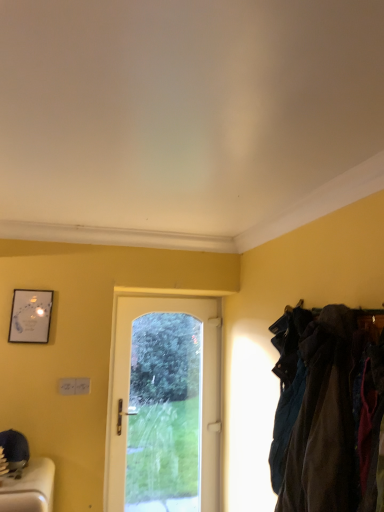
Question: Would you say dark blue fabric at right contains matte silver picture frame at upper left?

Choices:
 (A) yes
 (B) no

Answer: (B)

Question: Would you say dark blue fabric at right is a long distance from matte silver picture frame at upper left?

Choices:
 (A) yes
 (B) no

Answer: (A)

Question: Considering the relative sizes of dark blue fabric at right and matte silver picture frame at upper left in the image provided, is dark blue fabric at right thinner than matte silver picture frame at upper left?

Choices:
 (A) no
 (B) yes

Answer: (A)

Question: Considering the relative positions of dark blue fabric at right and matte silver picture frame at upper left in the image provided, is dark blue fabric at right to the left of matte silver picture frame at upper left from the viewer's perspective?

Choices:
 (A) no
 (B) yes

Answer: (A)

Question: From a real-world perspective, is dark blue fabric at right below matte silver picture frame at upper left?

Choices:
 (A) no
 (B) yes

Answer: (B)

Question: Is dark blue fabric at right not within matte silver picture frame at upper left?

Choices:
 (A) yes
 (B) no

Answer: (A)

Question: Is matte silver picture frame at upper left positioned beyond the bounds of dark blue fabric at right?

Choices:
 (A) no
 (B) yes

Answer: (B)

Question: Is matte silver picture frame at upper left bigger than dark blue fabric at right?

Choices:
 (A) no
 (B) yes

Answer: (A)

Question: From a real-world perspective, is matte silver picture frame at upper left over dark blue fabric at right?

Choices:
 (A) yes
 (B) no

Answer: (A)

Question: Can you confirm if matte silver picture frame at upper left is taller than dark blue fabric at right?

Choices:
 (A) no
 (B) yes

Answer: (A)

Question: Considering the relative sizes of matte silver picture frame at upper left and dark blue fabric at right in the image provided, is matte silver picture frame at upper left thinner than dark blue fabric at right?

Choices:
 (A) no
 (B) yes

Answer: (B)

Question: Is matte silver picture frame at upper left positioned with its back to dark blue fabric at right?

Choices:
 (A) yes
 (B) no

Answer: (B)

Question: Can you confirm if white glass door at center is bigger than matte silver picture frame at upper left?

Choices:
 (A) yes
 (B) no

Answer: (A)